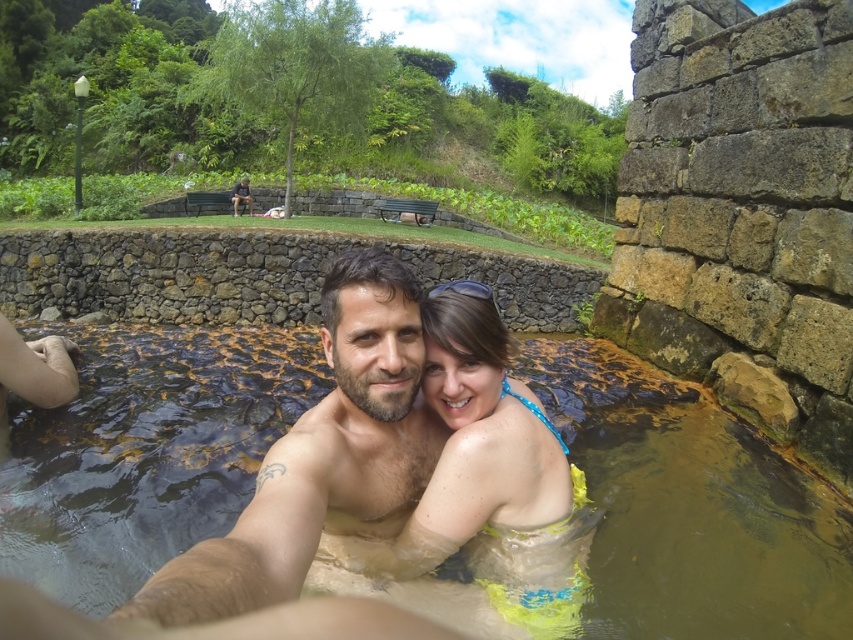
Question: Which point appears farthest from the camera in this image?

Choices:
 (A) (268, 392)
 (B) (576, 609)
 (C) (345, 467)

Answer: (A)

Question: Can you confirm if brown murky water at center is smaller than neon yellow fabric at center?

Choices:
 (A) no
 (B) yes

Answer: (A)

Question: Which of the following is the closest to the observer?

Choices:
 (A) (543, 444)
 (B) (125, 502)
 (C) (393, 396)

Answer: (C)

Question: Is smooth skin man at center below neon yellow fabric at center?

Choices:
 (A) yes
 (B) no

Answer: (B)

Question: Is brown murky water at center above smooth skin man at center?

Choices:
 (A) yes
 (B) no

Answer: (B)

Question: Estimate the real-world distances between objects in this image. Which object is farther from the neon yellow fabric at center?

Choices:
 (A) smooth skin man at center
 (B) brown murky water at center

Answer: (B)